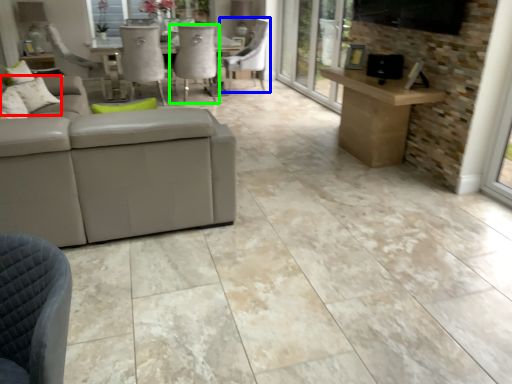
Question: Which object is positioned closest to pillow (highlighted by a red box)? Select from chair (highlighted by a blue box) and chair (highlighted by a green box).

Choices:
 (A) chair
 (B) chair

Answer: (B)